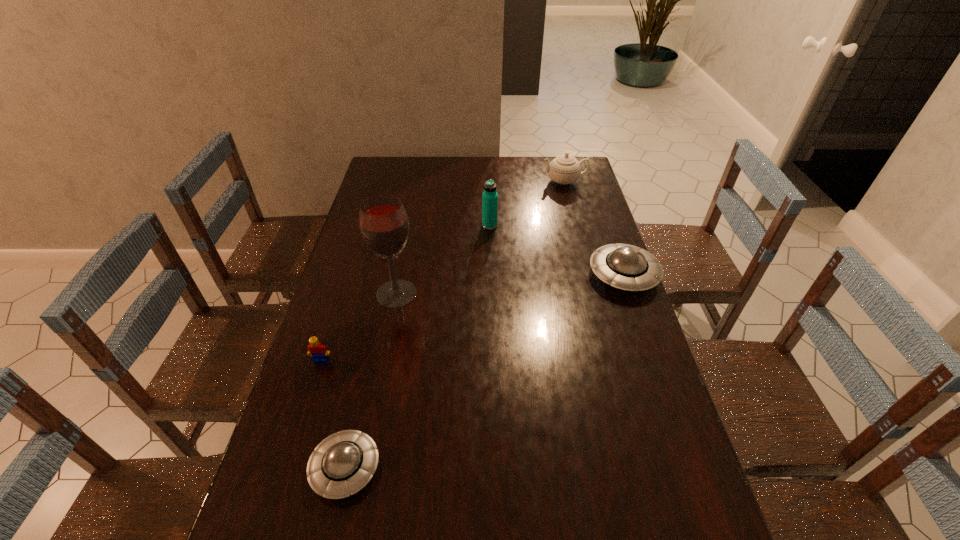
Where is `object that is positioned at the near edge`? The width and height of the screenshot is (960, 540). object that is positioned at the near edge is located at coordinates (342, 464).

I want to click on saucer that is positioned at the left edge, so click(x=342, y=464).

At what (x,y) coordinates should I click in order to perform the action: click on alcohol that is at the left edge. Please return your answer as a coordinate pair (x, y). This screenshot has height=540, width=960. Looking at the image, I should click on (384, 225).

Where is `Lego that is at the left edge`? Lego that is at the left edge is located at coordinates (319, 352).

This screenshot has width=960, height=540. What are the coordinates of `saucer located in the right edge section of the desktop` in the screenshot? It's located at (623, 266).

Image resolution: width=960 pixels, height=540 pixels. Identify the location of chinaware that is at the right edge. (564, 169).

This screenshot has height=540, width=960. Identify the location of object that is at the near left corner. (342, 464).

Where is `object that is at the far right corner`? The width and height of the screenshot is (960, 540). object that is at the far right corner is located at coordinates (564, 169).

Where is `vacant space at the far edge`? This screenshot has width=960, height=540. vacant space at the far edge is located at coordinates (467, 167).

Find the location of a particular element. vacant space at the near edge is located at coordinates (484, 502).